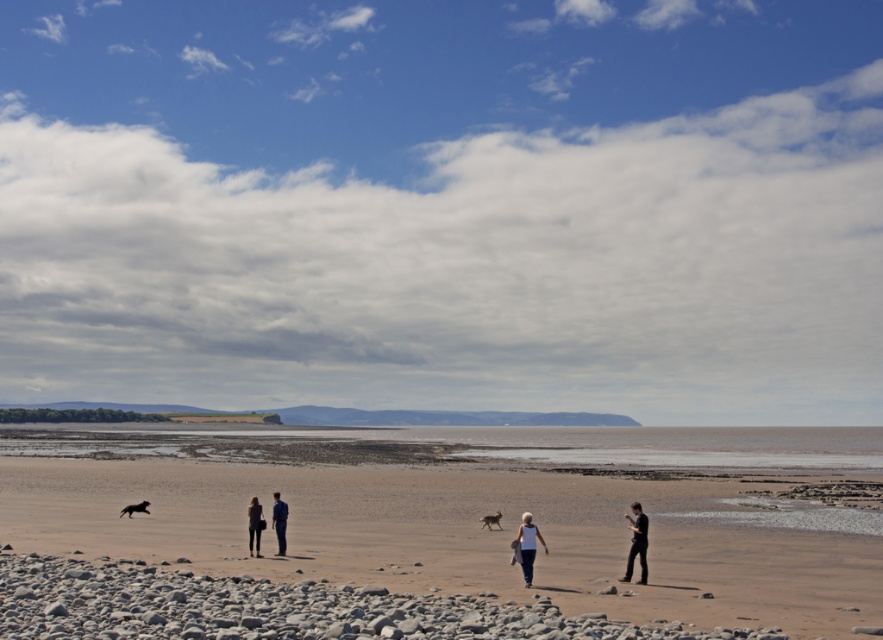
You are standing at the edge of the beach and want to pick up the smooth pebble at lower left without stepping on the dark blue jeans at lower right. Is this possible given their positions?

The smooth pebble at lower left is in front of the dark blue jeans at lower right, so you can reach the smooth pebble at lower left without stepping on the dark blue jeans at lower right by moving around or behind the jeans.